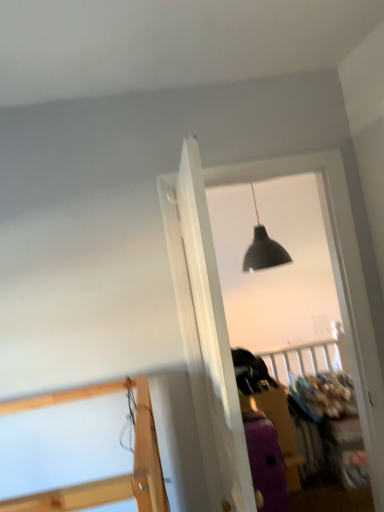
Locate an element on the screen. The image size is (384, 512). black matte glass door at center is located at coordinates (225, 319).

What do you see at coordinates (225, 319) in the screenshot? I see `black matte glass door at center` at bounding box center [225, 319].

Locate an element on the screen. This screenshot has width=384, height=512. black matte glass door at center is located at coordinates (225, 319).